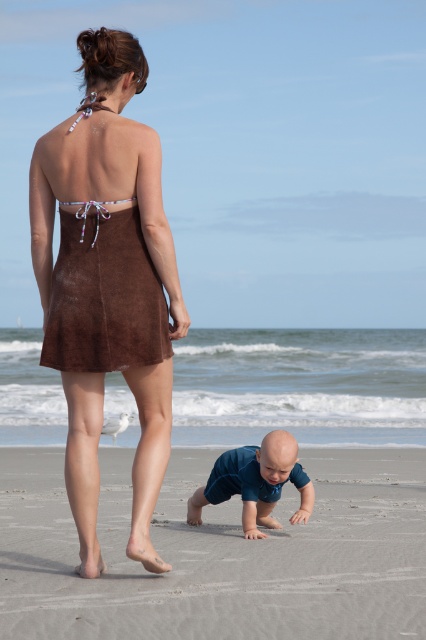
Who is more distant from viewer, (x=180, y=500) or (x=198, y=506)?

Positioned behind is point (x=180, y=500).

You are a GUI agent. You are given a task and a screenshot of the screen. Output one action in this format:
    pyautogui.click(x=<x>, y=<y>)
    Task: Click on the smooth sand at lower center
    
    Given the screenshot: What is the action you would take?
    pyautogui.click(x=218, y=554)

The height and width of the screenshot is (640, 426). Identify the location of smooth sand at lower center. (218, 554).

Is smooth sand at lower center below brown suede dress at center?

Correct, smooth sand at lower center is located below brown suede dress at center.

Does smooth sand at lower center have a lesser height compared to brown suede dress at center?

Indeed, smooth sand at lower center has a lesser height compared to brown suede dress at center.

Measure the distance between smooth sand at lower center and camera.

A distance of 16.22 feet exists between smooth sand at lower center and camera.

This screenshot has width=426, height=640. I want to click on smooth sand at lower center, so click(x=218, y=554).

Can you confirm if brown suede dress at center is positioned below blue fabric baby at lower center?

No, brown suede dress at center is not below blue fabric baby at lower center.

Does point (127, 164) come farther from viewer compared to point (221, 490)?

No, (127, 164) is in front of (221, 490).

Locate an element on the screen. The image size is (426, 640). brown suede dress at center is located at coordinates [108, 282].